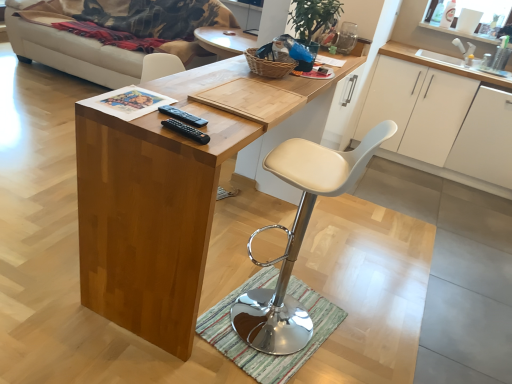
Where is `free space in front of black plastic remote at center`? free space in front of black plastic remote at center is located at coordinates (168, 132).